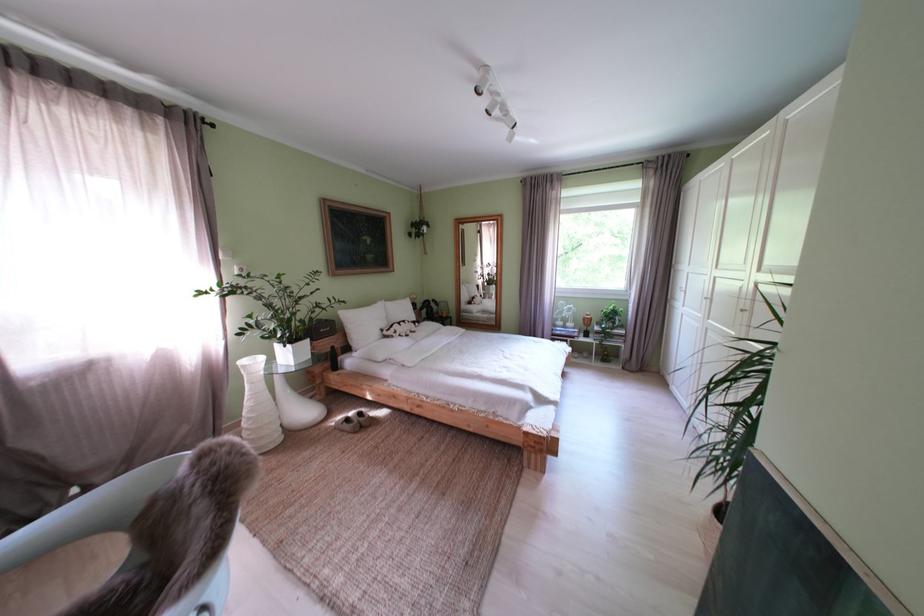
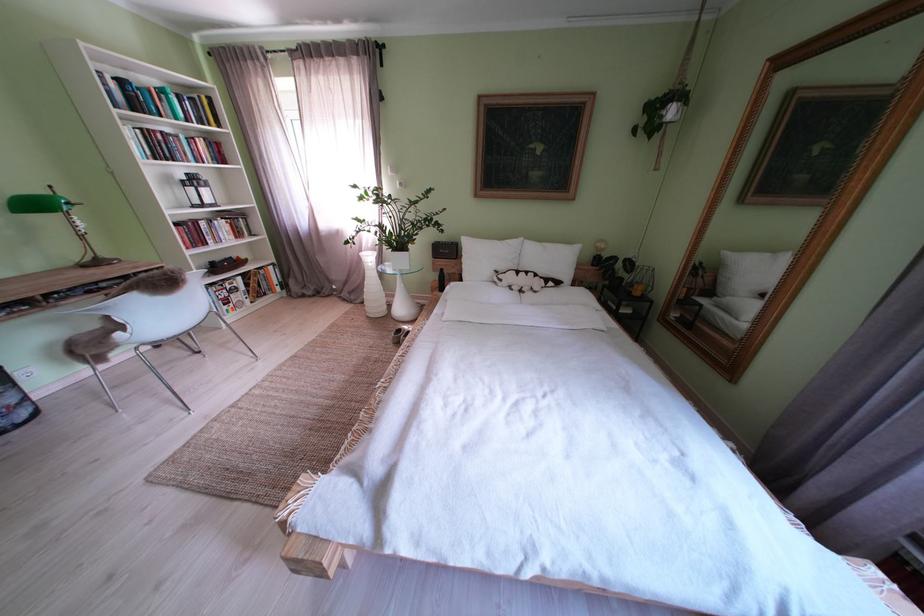
Find the pixel in the second image that matches (x=373, y=330) in the first image.

(490, 262)